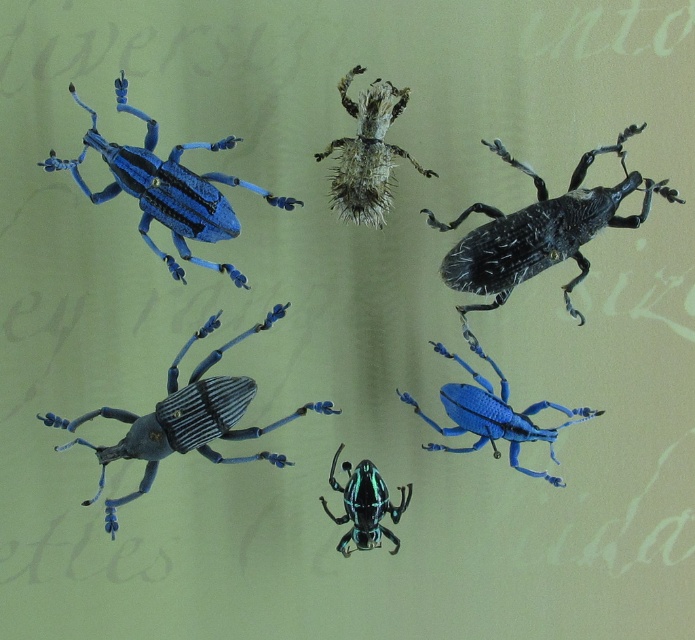
Who is lower down, matte blue plastic beetle at upper left or fuzzy brown beetle at center?

matte blue plastic beetle at upper left

Who is positioned more to the left, matte blue plastic beetle at upper left or fuzzy brown beetle at center?

Positioned to the left is matte blue plastic beetle at upper left.

What are the coordinates of `matte blue plastic beetle at upper left` in the screenshot? It's located at pyautogui.click(x=165, y=188).

Between shiny black beetle at upper right and matte blue plastic beetle at upper left, which one has more height?

shiny black beetle at upper right is taller.

Between shiny black beetle at upper right and matte blue plastic beetle at upper left, which one appears on the right side from the viewer's perspective?

shiny black beetle at upper right is more to the right.

Between point (514, 253) and point (236, 273), which one is positioned in front?

Point (236, 273)

You are a GUI agent. You are given a task and a screenshot of the screen. Output one action in this format:
    pyautogui.click(x=<x>, y=<y>)
    Task: Click on the shiny black beetle at upper right
    This screenshot has width=695, height=640.
    Given the screenshot: What is the action you would take?
    pyautogui.click(x=539, y=228)

Is fuzzy brown beetle at center to the left of metallic green beetle at center from the viewer's perspective?

Incorrect, fuzzy brown beetle at center is not on the left side of metallic green beetle at center.

Can you confirm if fuzzy brown beetle at center is shorter than metallic green beetle at center?

No, fuzzy brown beetle at center is not shorter than metallic green beetle at center.

Is point (389, 99) more distant than point (361, 499)?

That is False.

At what (x,y) coordinates should I click in order to perform the action: click on fuzzy brown beetle at center. Please return your answer as a coordinate pair (x, y). Looking at the image, I should click on (367, 152).